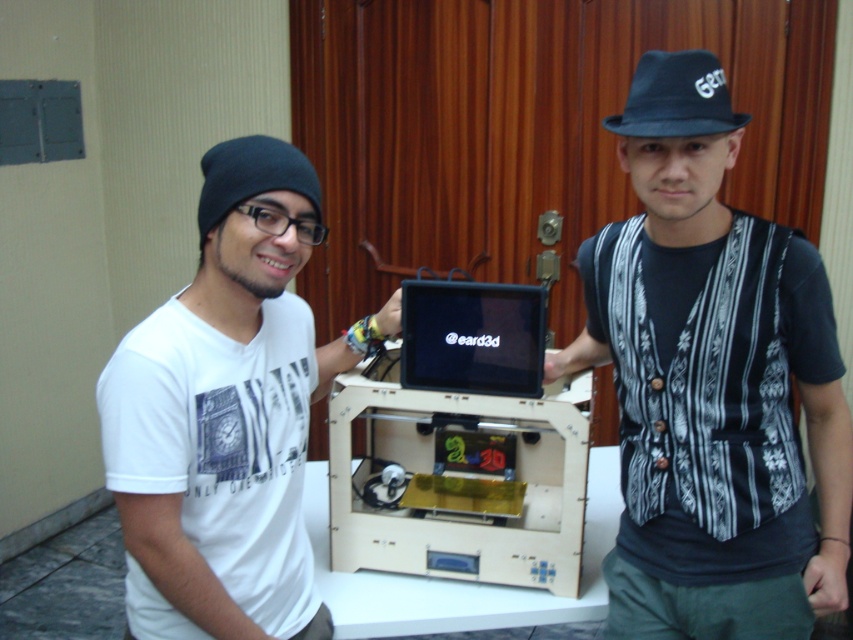
Between white matte t-shirt at center and black knit beanie at left, which one appears on the right side from the viewer's perspective?

white matte t-shirt at center is more to the right.

Does point (292, 592) come behind point (221, 192)?

Yes, it is behind point (221, 192).

Does point (299, 397) come behind point (236, 176)?

Yes, point (299, 397) is farther from viewer.

Locate an element on the screen. This screenshot has height=640, width=853. white matte t-shirt at center is located at coordinates (227, 413).

Can you confirm if matte black laptop at center is wider than black knit beanie at left?

Correct, the width of matte black laptop at center exceeds that of black knit beanie at left.

This screenshot has width=853, height=640. Identify the location of matte black laptop at center. (473, 337).

Locate an element on the screen. matte black laptop at center is located at coordinates (473, 337).

Does black knitted hat at upper center have a greater width compared to black fabric baseball hat at upper center?

Yes, black knitted hat at upper center is wider than black fabric baseball hat at upper center.

Does black knitted hat at upper center appear on the left side of black fabric baseball hat at upper center?

No, black knitted hat at upper center is not to the left of black fabric baseball hat at upper center.

Is point (668, 637) behind point (688, 81)?

Yes.

The height and width of the screenshot is (640, 853). In order to click on black knitted hat at upper center in this screenshot , I will do `click(711, 381)`.